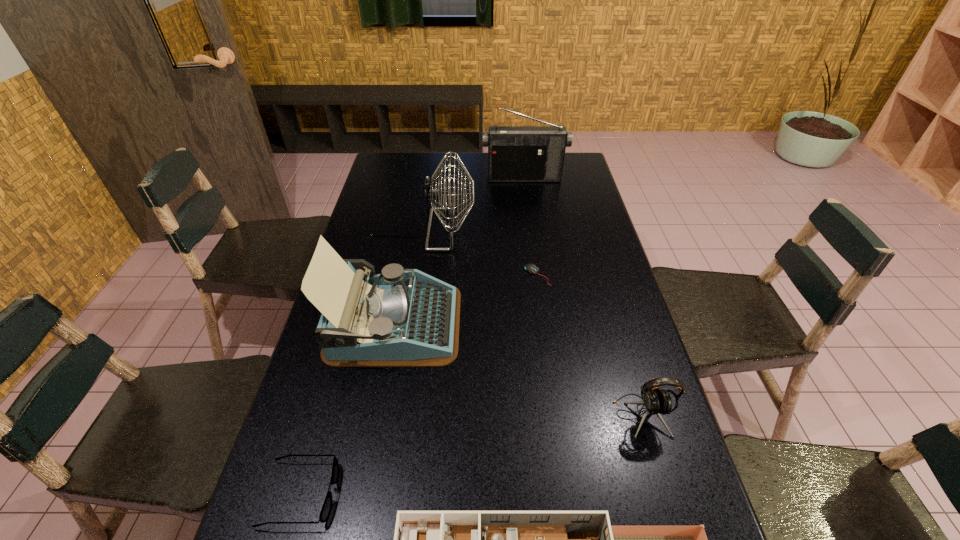
Find the location of a particular element. This screenshot has height=540, width=960. radio receiver is located at coordinates (515, 153).

Locate an element on the screen. This screenshot has width=960, height=540. fan is located at coordinates (432, 192).

The height and width of the screenshot is (540, 960). I want to click on typewriter, so click(398, 318).

Image resolution: width=960 pixels, height=540 pixels. Find the location of `the third nearest object`. the third nearest object is located at coordinates (656, 401).

You are a GUI agent. You are given a task and a screenshot of the screen. Output one action in this format:
    pyautogui.click(x=<x>, y=<y>)
    Task: Click on the fourth tallest object
    The width and height of the screenshot is (960, 540).
    Given the screenshot: What is the action you would take?
    pyautogui.click(x=656, y=401)

I want to click on spectacles, so click(x=327, y=505).

At what (x,y) coordinates should I click in order to perform the action: click on the sixth tallest object. Please return your answer as a coordinate pair (x, y). Looking at the image, I should click on (327, 505).

Find the location of `the shortest object`. the shortest object is located at coordinates (531, 268).

You are a GUI agent. You are given a task and a screenshot of the screen. Output one action in this format:
    pyautogui.click(x=<x>, y=<y>)
    Task: Click on the vacant space located 0.140m on the front-facing side of the farthest object
    
    Given the screenshot: What is the action you would take?
    pyautogui.click(x=527, y=202)

In order to click on vacant region located on the front-facing side of the fan in this screenshot , I will do pyautogui.click(x=500, y=230).